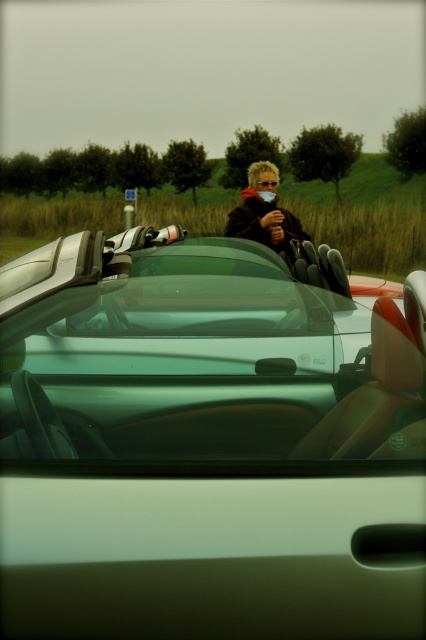
Question: Which point appears farthest from the camera in this image?

Choices:
 (A) (261, 234)
 (B) (259, 474)

Answer: (A)

Question: Based on their relative distances, which object is farther from the translucent orange goggles at center?

Choices:
 (A) matte black jacket at center
 (B) metallic silver convertible at center

Answer: (B)

Question: Can you confirm if metallic silver convertible at center is positioned above matte black jacket at center?

Choices:
 (A) yes
 (B) no

Answer: (B)

Question: Can you confirm if matte black jacket at center is thinner than translucent orange goggles at center?

Choices:
 (A) yes
 (B) no

Answer: (B)

Question: Which of the following is the closest to the observer?

Choices:
 (A) matte black jacket at center
 (B) metallic silver convertible at center
 (C) translucent orange goggles at center

Answer: (B)

Question: Is metallic silver convertible at center further to camera compared to matte black jacket at center?

Choices:
 (A) yes
 (B) no

Answer: (B)